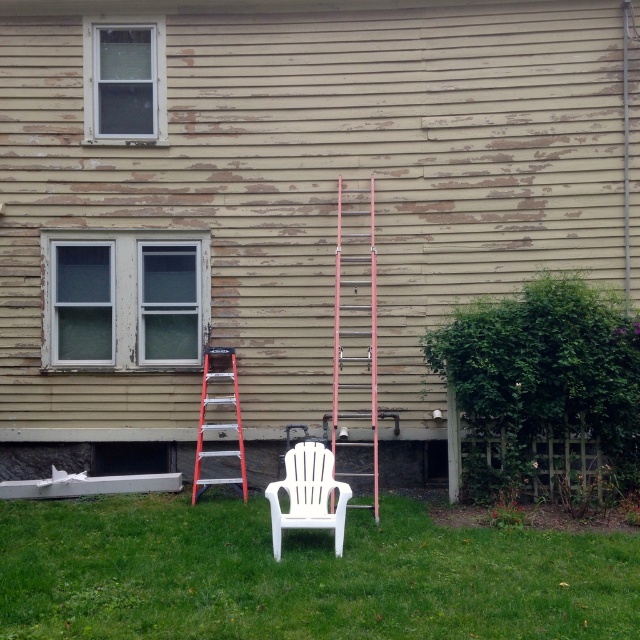
Is the position of white plastic chair at center less distant than that of metallic silver ladder at left?

Yes, white plastic chair at center is closer to the viewer.

Is white plastic chair at center smaller than metallic silver ladder at left?

Yes, white plastic chair at center is smaller than metallic silver ladder at left.

Is point (307, 490) more distant than point (243, 481)?

No, it is not.

In order to click on white plastic chair at center in this screenshot , I will do `click(307, 493)`.

Does green grass at center appear on the right side of metallic silver ladder at left?

Correct, you'll find green grass at center to the right of metallic silver ladder at left.

Image resolution: width=640 pixels, height=640 pixels. What do you see at coordinates (300, 573) in the screenshot?
I see `green grass at center` at bounding box center [300, 573].

Identify the location of green grass at center. This screenshot has height=640, width=640. (300, 573).

Does point (369, 257) come closer to viewer compared to point (304, 520)?

No, (369, 257) is further to viewer.

Does rustic wood ladder at center have a lesser height compared to white plastic chair at center?

Incorrect, rustic wood ladder at center's height does not fall short of white plastic chair at center's.

Is point (372, 262) closer to viewer compared to point (285, 465)?

No, (372, 262) is further to viewer.

Locate an element on the screen. rustic wood ladder at center is located at coordinates (355, 336).